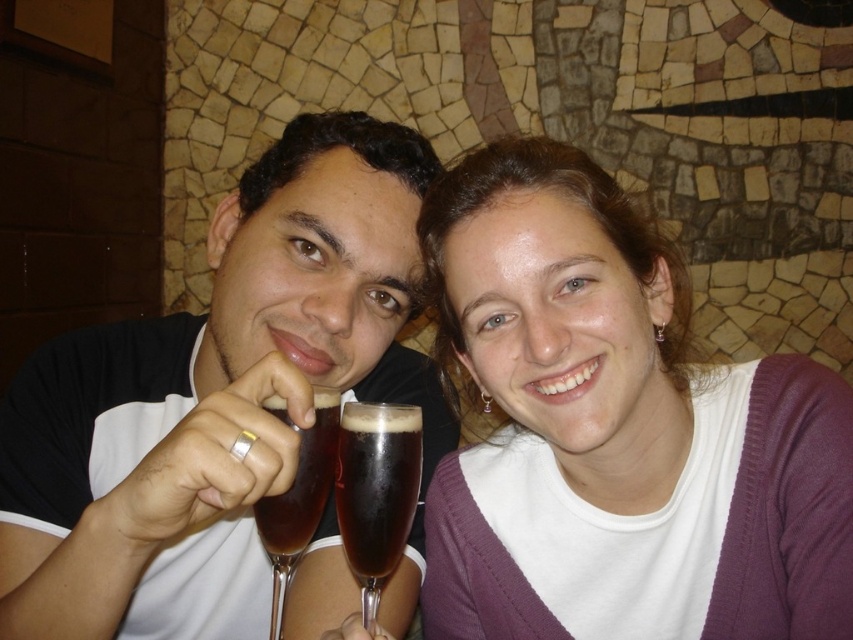
Question: Which object appears closest to the camera in this image?

Choices:
 (A) white knitwear at upper right
 (B) translucent dark brown glass at center

Answer: (B)

Question: Is matte black shirt at left bigger than translucent dark brown glass at center?

Choices:
 (A) no
 (B) yes

Answer: (B)

Question: Considering the relative positions of white knitwear at upper right and translucent dark brown glass at center in the image provided, where is white knitwear at upper right located with respect to translucent dark brown glass at center?

Choices:
 (A) right
 (B) left

Answer: (A)

Question: Which is nearer to the translucent dark brown glass at center?

Choices:
 (A) matte black shirt at left
 (B) white knitwear at upper right

Answer: (A)

Question: Which point is closer to the camera?

Choices:
 (A) (370, 552)
 (B) (440, 204)
 (C) (3, 547)
 (D) (265, 397)

Answer: (D)

Question: Can you confirm if matte black shirt at left is positioned to the right of dark brown glass at center?

Choices:
 (A) no
 (B) yes

Answer: (A)